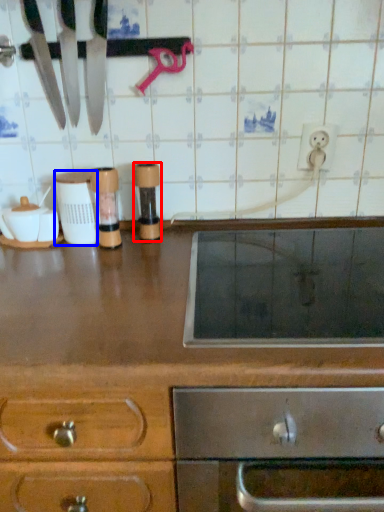
Question: Which of the following is the farthest to the observer, appliance (highlighted by a red box) or appliance (highlighted by a blue box)?

Choices:
 (A) appliance
 (B) appliance

Answer: (A)